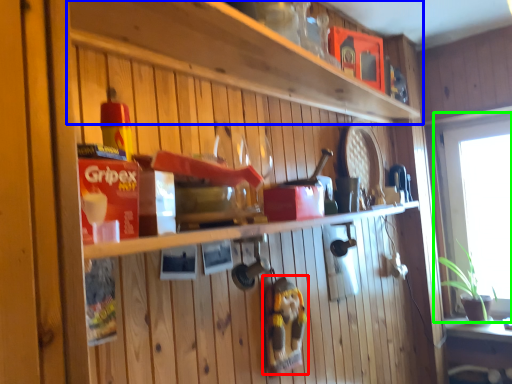
Question: Based on their relative distances, which object is farther from toy (highlighted by a red box)? Choose from shelf (highlighted by a blue box) and window (highlighted by a green box).

Choices:
 (A) shelf
 (B) window

Answer: (B)